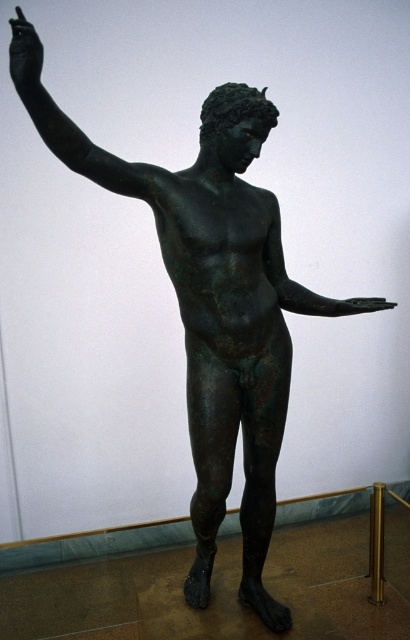
Question: Considering the real-world distances, which object is closest to the bronze statue hand at upper left?

Choices:
 (A) bronze arm at center
 (B) bronze arm at upper left

Answer: (B)

Question: Based on their relative distances, which object is farther from the bronze arm at upper left?

Choices:
 (A) bronze arm at center
 (B) bronze hand at center

Answer: (B)

Question: Is bronze arm at upper left bigger than bronze arm at center?

Choices:
 (A) no
 (B) yes

Answer: (B)

Question: Which of the following is the closest to the observer?

Choices:
 (A) bronze hand at center
 (B) bronze arm at center
 (C) bronze arm at upper left
 (D) bronze statue hand at upper left

Answer: (D)

Question: Does bronze arm at upper left have a larger size compared to bronze arm at center?

Choices:
 (A) no
 (B) yes

Answer: (B)

Question: Is bronze arm at center below bronze statue hand at upper left?

Choices:
 (A) no
 (B) yes

Answer: (B)